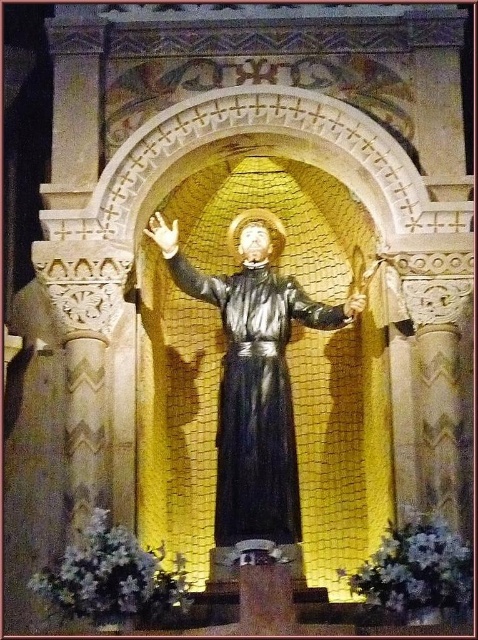
Looking at this image, you are a visitor in the church and want to take a photo of the statue. The black matte robe at center and the matte gold chain at upper center are both in your viewfinder. Which object should you focus on first if you want to capture the taller one?

The black matte robe at center has a greater height compared to the matte gold chain at upper center, so you should focus on the black matte robe at center first to capture the taller one.

You are a visitor standing at the entrance of the cathedral and want to know if you can touch both the matte white hand at center and the matte gold chain at upper center without moving your position. Can you reach both objects from where you are standing?

The distance between the matte white hand at center and the matte gold chain at upper center is 14.61 meters. Since this distance is quite large, you would not be able to touch both objects simultaneously from your current position without moving.

Consider the image. You are an interior designer planning to place a new decorative item in the alcove where the black matte robe at center and the matte gold chain at upper center are located. Considering their widths, which object would require more horizontal space for placement adjustments?

The black matte robe at center requires more horizontal space because its width surpasses that of the matte gold chain at upper center.